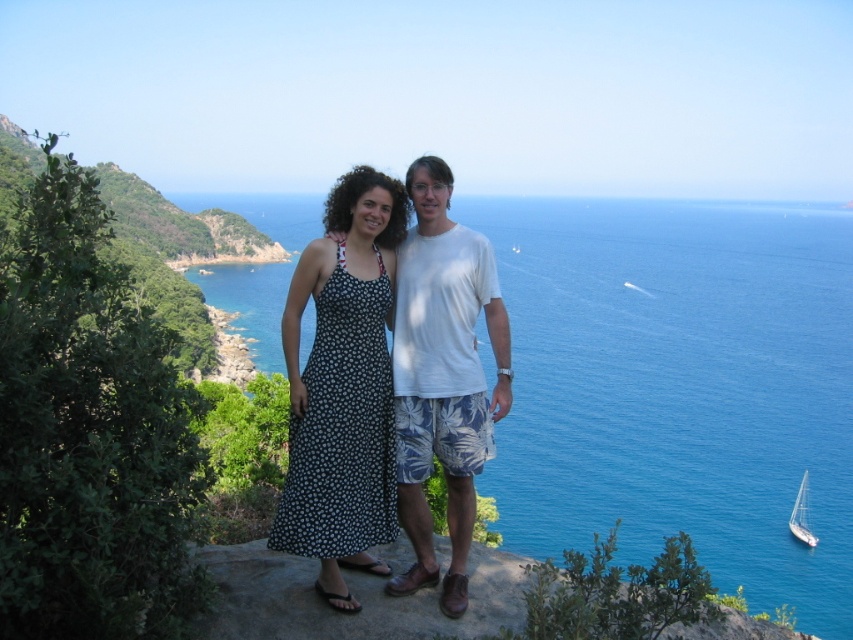
Question: Is blue liquid water at center thinner than white glossy sailboat at lower right?

Choices:
 (A) yes
 (B) no

Answer: (B)

Question: Which of these objects is positioned farthest from the blue liquid water at center?

Choices:
 (A) white glossy sailboat at lower right
 (B) white cotton shirt at center
 (C) black floral dress at center

Answer: (C)

Question: Does blue liquid water at center have a smaller size compared to black floral dress at center?

Choices:
 (A) yes
 (B) no

Answer: (B)

Question: Which object is closer to the camera taking this photo?

Choices:
 (A) white glossy sailboat at lower right
 (B) white cotton shirt at center
 (C) black floral dress at center
 (D) blue liquid water at center

Answer: (C)

Question: Does black floral dress at center appear over white cotton shirt at center?

Choices:
 (A) no
 (B) yes

Answer: (A)

Question: Considering the real-world distances, which object is closest to the black floral dress at center?

Choices:
 (A) white cotton shirt at center
 (B) blue liquid water at center
 (C) white glossy sailboat at lower right

Answer: (A)